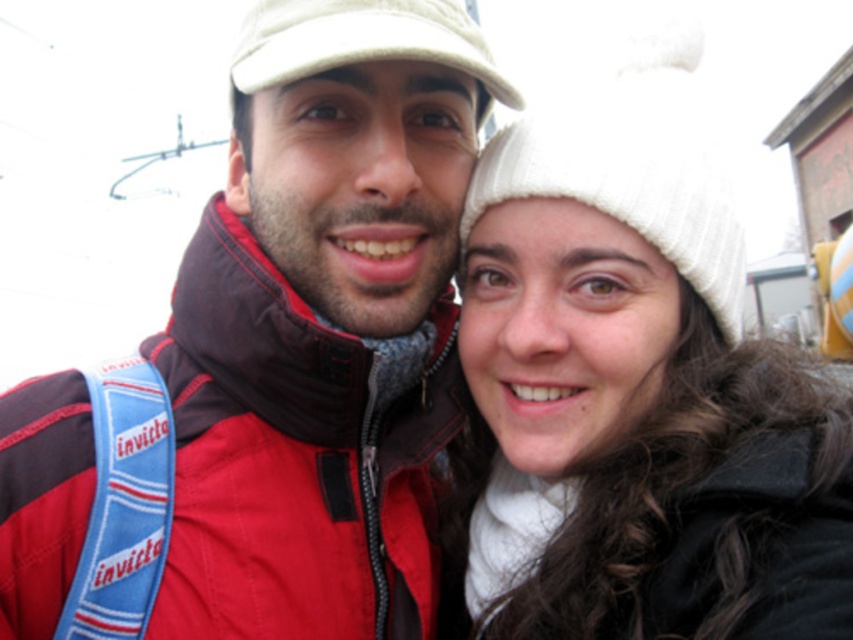
Describe the element at coordinates (631, 394) in the screenshot. The height and width of the screenshot is (640, 853). I see `white knit hat at upper right` at that location.

Can you confirm if white knit hat at upper right is bigger than white fabric cap at upper center?

Yes, white knit hat at upper right is bigger than white fabric cap at upper center.

What do you see at coordinates (631, 394) in the screenshot? This screenshot has height=640, width=853. I see `white knit hat at upper right` at bounding box center [631, 394].

Where is `white knit hat at upper right`? The height and width of the screenshot is (640, 853). white knit hat at upper right is located at coordinates click(631, 394).

Is white knit hat at upper right to the right of red matte jacket at center from the viewer's perspective?

Correct, you'll find white knit hat at upper right to the right of red matte jacket at center.

Who is taller, white knit hat at upper right or red matte jacket at center?

Standing taller between the two is white knit hat at upper right.

Is point (573, 524) farther from camera compared to point (16, 390)?

Yes, point (573, 524) is farther from viewer.

Identify the location of white knit hat at upper right. This screenshot has width=853, height=640. (631, 394).

Looking at this image, can you confirm if red matte jacket at center is bigger than white fabric cap at upper center?

Correct, red matte jacket at center is larger in size than white fabric cap at upper center.

Which is below, red matte jacket at center or white fabric cap at upper center?

Positioned lower is red matte jacket at center.

Who is more distant from viewer, (346,356) or (494,90)?

Point (494,90)

The width and height of the screenshot is (853, 640). Find the location of `red matte jacket at center`. red matte jacket at center is located at coordinates (287, 461).